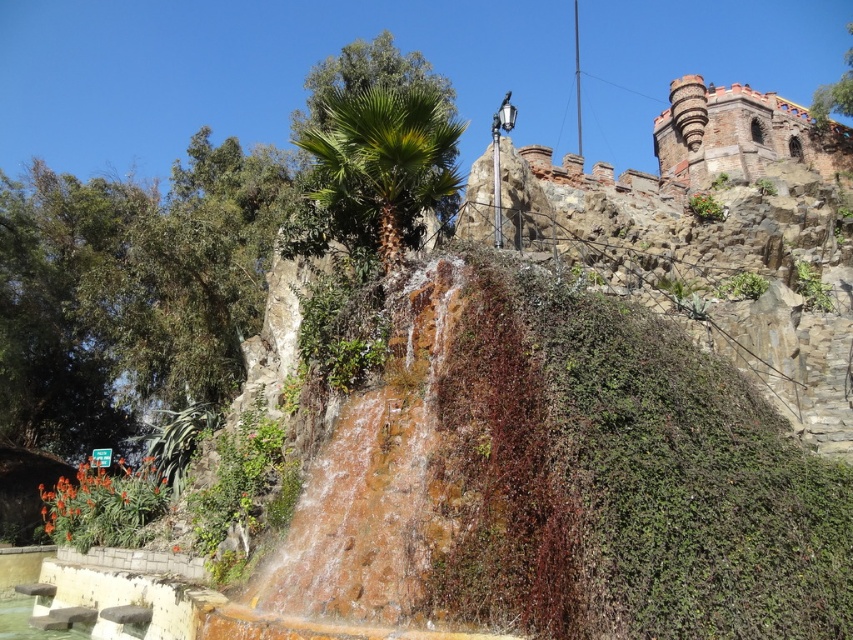
Question: Which point appears closest to the camera in this image?

Choices:
 (A) (431, 120)
 (B) (90, 627)

Answer: (B)

Question: Does green leafy palm at center appear over clear water at bottom left?

Choices:
 (A) no
 (B) yes

Answer: (B)

Question: Which point is farther to the camera?

Choices:
 (A) clear water at bottom left
 (B) green leafy palm at center

Answer: (B)

Question: Can you confirm if green leafy palm at center is thinner than clear water at bottom left?

Choices:
 (A) yes
 (B) no

Answer: (B)

Question: Among these objects, which one is nearest to the camera?

Choices:
 (A) clear water at bottom left
 (B) green leafy palm at center

Answer: (A)

Question: Can you confirm if green leafy palm at center is smaller than clear water at bottom left?

Choices:
 (A) no
 (B) yes

Answer: (A)